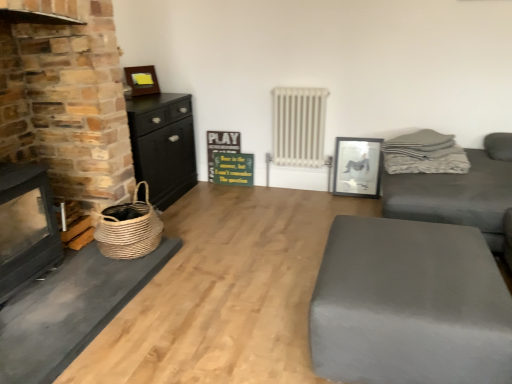
Identify the location of free location to the right of black wood chest of drawers at left. (208, 197).